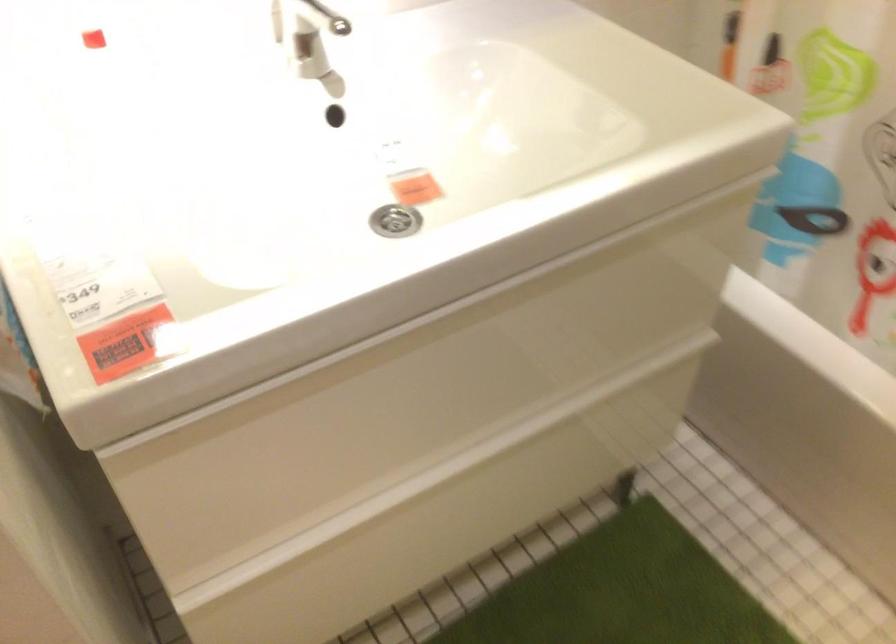
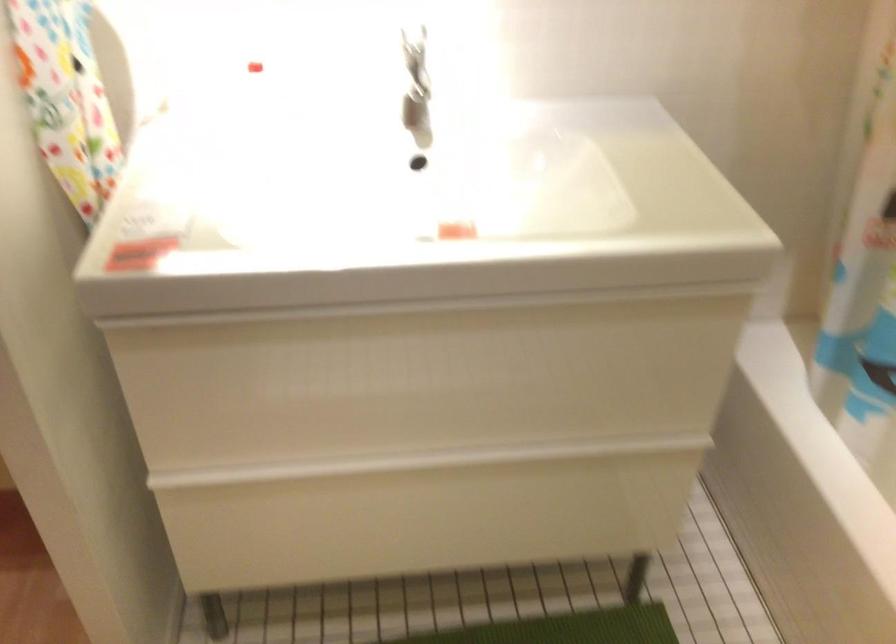
Question: Based on the continuous images, in which direction is the camera rotating? Reply with the corresponding letter.

Choices:
 (A) Left
 (B) Right
 (C) Up
 (D) Down

Answer: (A)